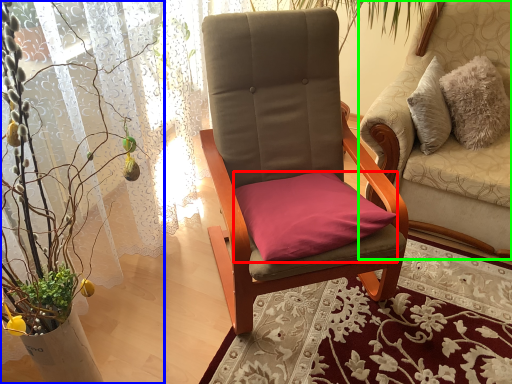
Question: Considering the real-world distances, which object is farthest from pillow (highlighted by a red box)? houseplant (highlighted by a blue box) or chair (highlighted by a green box)?

Choices:
 (A) houseplant
 (B) chair

Answer: (B)